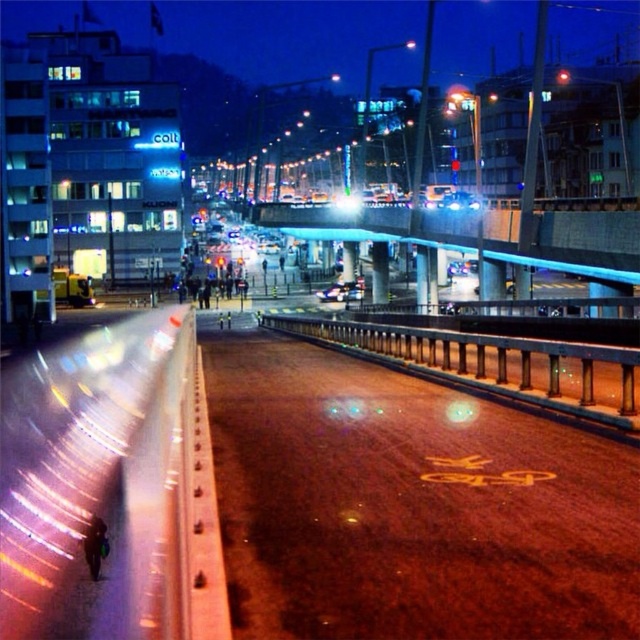
Is blue glass bridge at center positioned before metallic silver car at center?

Yes, it is in front of metallic silver car at center.

Can you confirm if blue glass bridge at center is bigger than metallic silver car at center?

Correct, blue glass bridge at center is larger in size than metallic silver car at center.

Who is more forward, (579, 262) or (360, 288)?

Point (579, 262) is more forward.

I want to click on blue glass bridge at center, so click(476, 232).

Which is above, yellow asphalt at center or blue glass bridge at center?

blue glass bridge at center is higher up.

Can you confirm if yellow asphalt at center is smaller than blue glass bridge at center?

Correct, yellow asphalt at center occupies less space than blue glass bridge at center.

Describe the element at coordinates (408, 502) in the screenshot. I see `yellow asphalt at center` at that location.

The image size is (640, 640). I want to click on yellow asphalt at center, so click(x=408, y=502).

Does yellow asphalt at center appear under metallic silver car at center?

Yes, yellow asphalt at center is below metallic silver car at center.

Is yellow asphalt at center thinner than metallic silver car at center?

Incorrect, yellow asphalt at center's width is not less than metallic silver car at center's.

Who is more distant from viewer, (502, 436) or (333, 288)?

The point (333, 288) is more distant.

Where is `yellow asphalt at center`? The width and height of the screenshot is (640, 640). yellow asphalt at center is located at coordinates (408, 502).